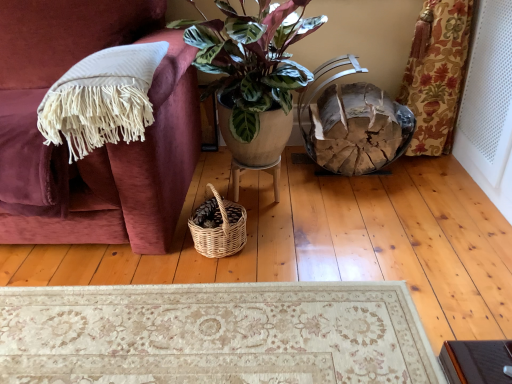
Question: Is woven natural picnic basket at lower center in front of or behind white fringed blanket at left in the image?

Choices:
 (A) front
 (B) behind

Answer: (B)

Question: Is woven natural picnic basket at lower center taller or shorter than white fringed blanket at left?

Choices:
 (A) short
 (B) tall

Answer: (A)

Question: Which object is the farthest from the white perforated screen door at right?

Choices:
 (A) woven natural picnic basket at lower center
 (B) wooden textured basket at lower right
 (C) wooden stool at center
 (D) white fringed blanket at left
 (E) green glossy plant pot at center

Answer: (D)

Question: Estimate the real-world distances between objects in this image. Which object is farther from the woven natural picnic basket at lower center?

Choices:
 (A) white perforated screen door at right
 (B) wooden textured basket at lower right
 (C) white fringed blanket at left
 (D) green glossy plant pot at center
 (E) wooden stool at center

Answer: (A)